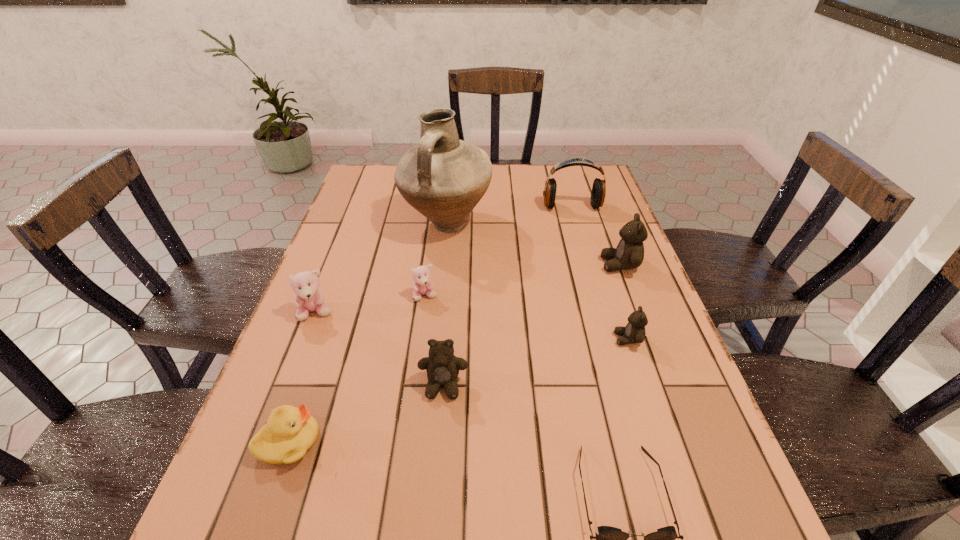
I want to click on teddy bear that is the fourth nearest to the headset, so click(442, 366).

Where is `teddy bear that can be found as the fourth closest to the bigger pink teddy bear`? This screenshot has width=960, height=540. teddy bear that can be found as the fourth closest to the bigger pink teddy bear is located at coordinates (629, 254).

Locate an element on the screen. The width and height of the screenshot is (960, 540). brown teddy bear that is the second closest to the nearest brown teddy bear is located at coordinates (629, 254).

The width and height of the screenshot is (960, 540). Identify the location of the closest brown teddy bear to the headset. (629, 254).

Locate an element on the screen. The image size is (960, 540). free spot that satisfies the following two spatial constraints: 1. at the face of the right pink teddy bear; 2. on the beak of the yellow duckling is located at coordinates (405, 442).